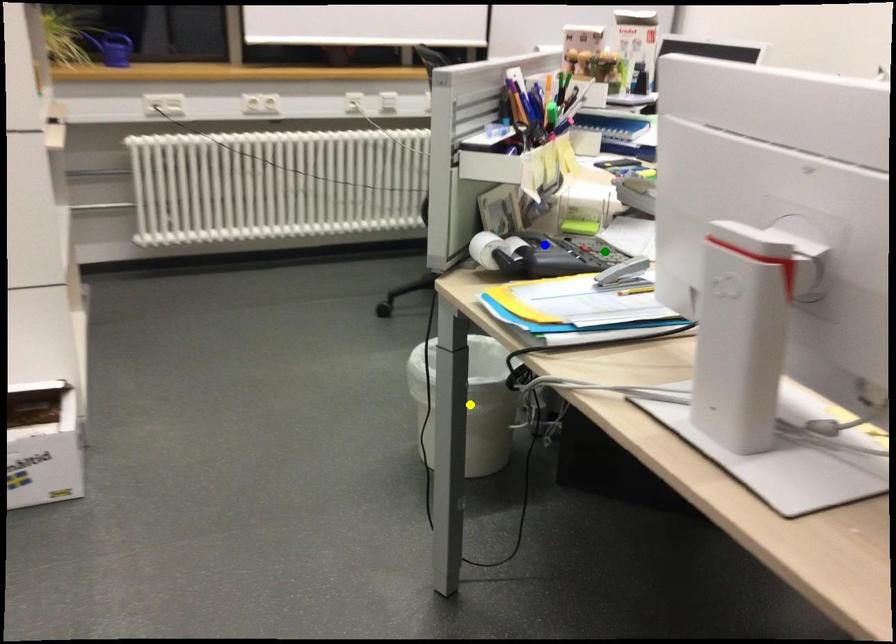
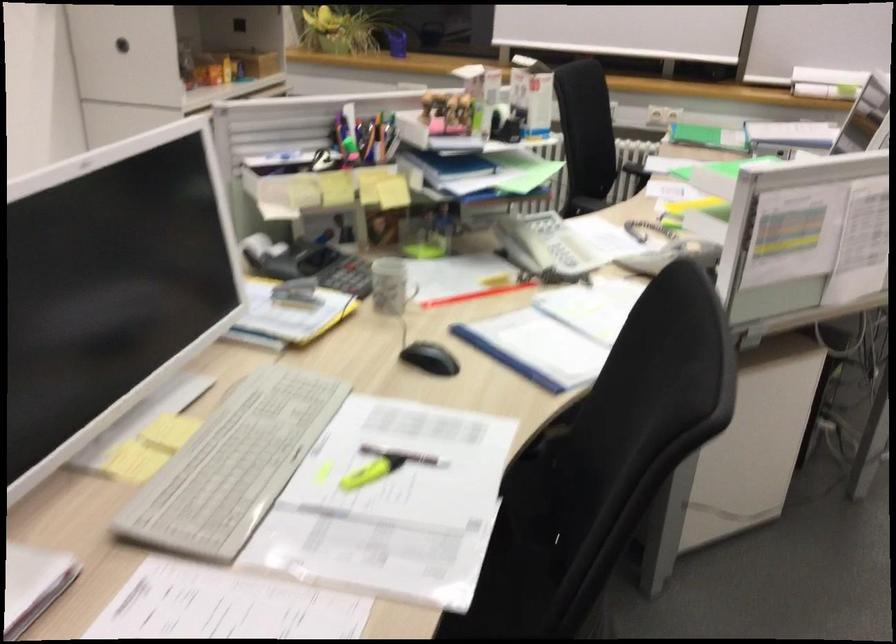
I am providing you with two images of the same scene from different viewpoints. Three points are marked in image1. Which point corresponds to a part or object that is occluded in image2?In image1, three points are marked. Which of them correspond to a part or object that is occluded in image2?Among the three points shown in image1, which one corresponds to a part or object that is no longer visible due to occlusion in image2?

Invisible in image2: yellow point.